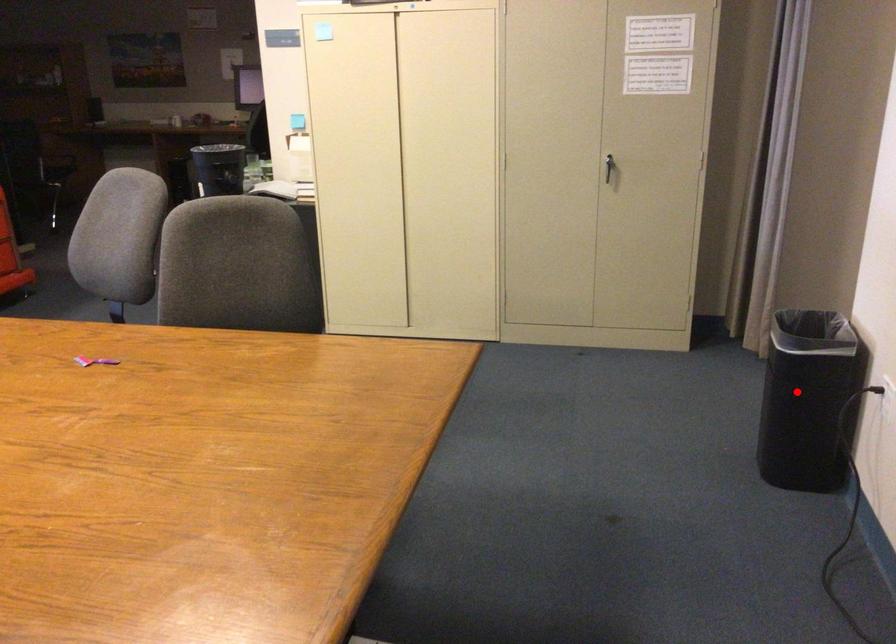
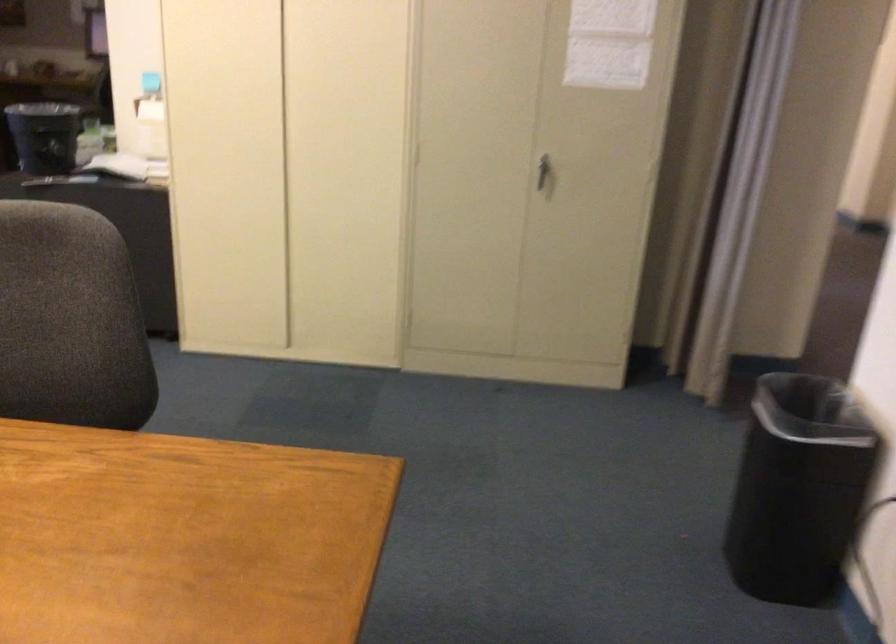
Find the pixel in the second image that matches the highlighted location in the first image.

(798, 489)